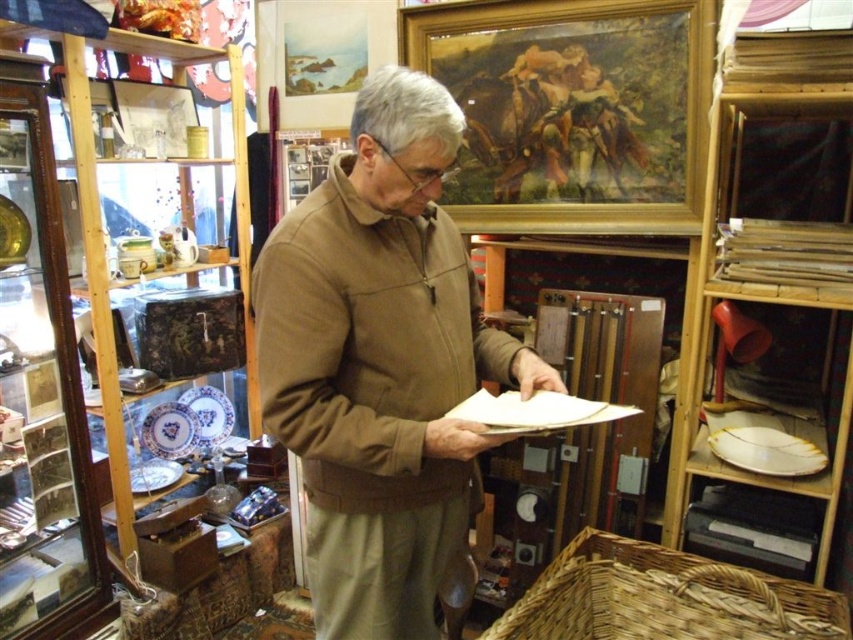
Is porcelain plate at center further to the viewer compared to porcelain plate at lower left?

Yes.

Is porcelain plate at center to the right of porcelain plate at lower left from the viewer's perspective?

Correct, you'll find porcelain plate at center to the right of porcelain plate at lower left.

Which is in front, point (165, 448) or point (140, 472)?

Point (140, 472)

The image size is (853, 640). In order to click on porcelain plate at center in this screenshot , I will do `click(170, 429)`.

How distant is white glossy plate at lower right from porcelain plate at center?

white glossy plate at lower right is 2.04 meters from porcelain plate at center.

Is white glossy plate at lower right above porcelain plate at center?

Yes, white glossy plate at lower right is above porcelain plate at center.

Is point (770, 468) behind point (173, 448)?

No, (770, 468) is in front of (173, 448).

Identify the location of white glossy plate at lower right. The image size is (853, 640). (766, 451).

How much distance is there between brown soft jacket at center and porcelain plate at lower left?

brown soft jacket at center is 4.99 feet from porcelain plate at lower left.

You are a GUI agent. You are given a task and a screenshot of the screen. Output one action in this format:
    pyautogui.click(x=<x>, y=<y>)
    Task: Click on the brown soft jacket at center
    This screenshot has width=853, height=640.
    Given the screenshot: What is the action you would take?
    pyautogui.click(x=380, y=362)